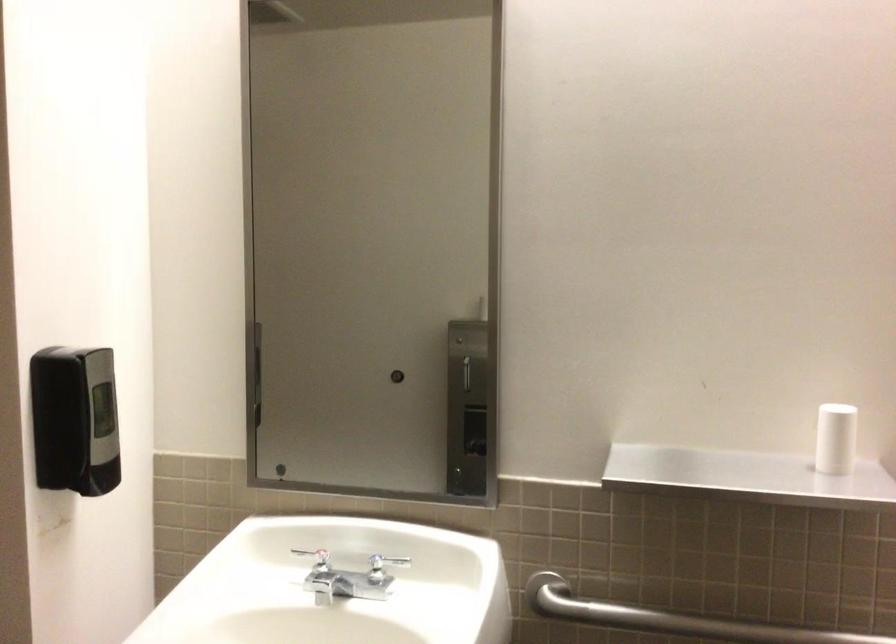
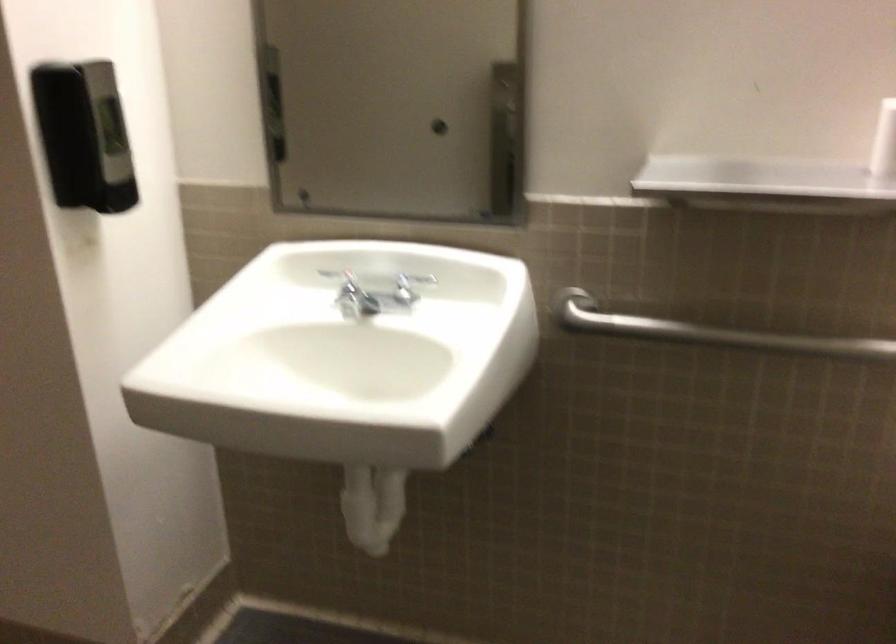
Find the pixel in the second image that matches (x=380, y=572) in the first image.

(403, 290)